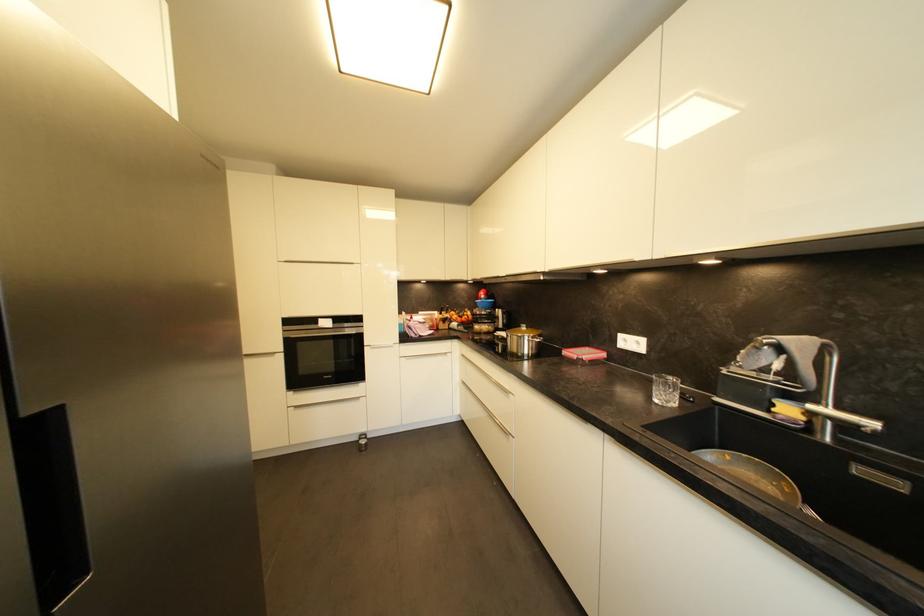
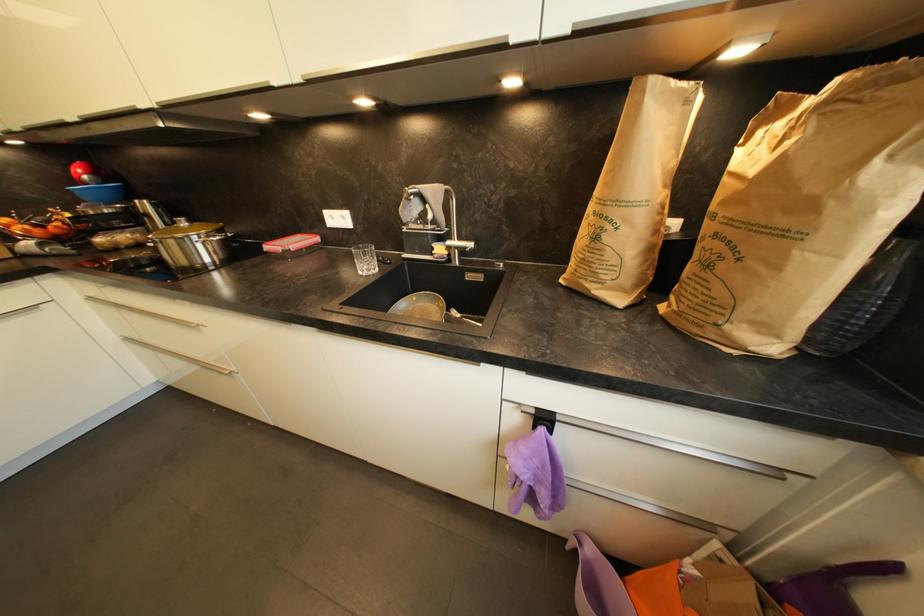
The first image is from the beginning of the video and the second image is from the end. How did the camera likely rotate when shooting the video?

The camera's rotation is toward right-down.